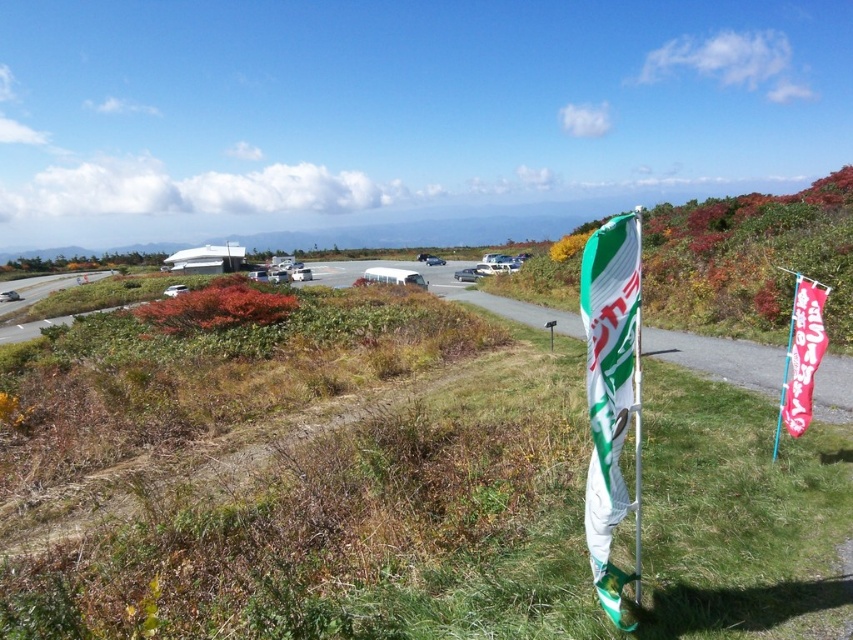
Is white fabric flag at right wider than red fabric flag at right?

In fact, white fabric flag at right might be narrower than red fabric flag at right.

Where is `white fabric flag at right`? This screenshot has width=853, height=640. white fabric flag at right is located at coordinates (610, 390).

Does green grass at center appear over white fabric flag at right?

Yes.

Is green grass at center thinner than white fabric flag at right?

In fact, green grass at center might be wider than white fabric flag at right.

Is point (77, 611) less distant than point (610, 394)?

No, (77, 611) is behind (610, 394).

In order to click on green grass at center in this screenshot , I will do `click(297, 477)`.

Consider the image. Which of these two, green grass at center or red fabric flag at right, stands shorter?

red fabric flag at right

Between point (401, 324) and point (795, 305), which one is positioned behind?

Point (401, 324)

The width and height of the screenshot is (853, 640). I want to click on green grass at center, so click(x=297, y=477).